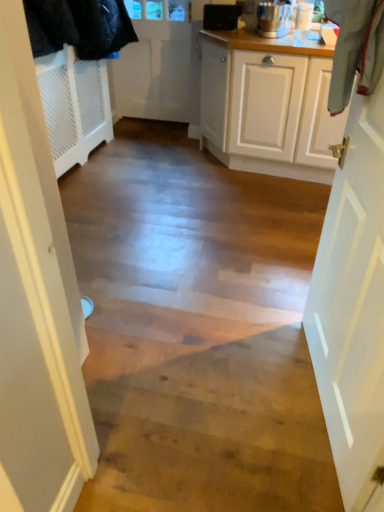
Identify the location of vacant point to the left of white matte door at right, which is the second door from left to right. (227, 382).